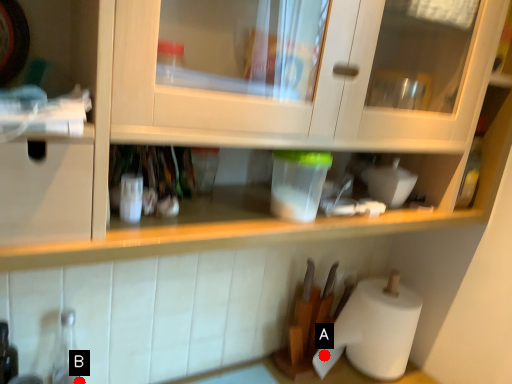
Question: Two points are circled on the image, labeled by A and B beside each circle. Which point is closer to the camera?

Choices:
 (A) A is closer
 (B) B is closer

Answer: (B)